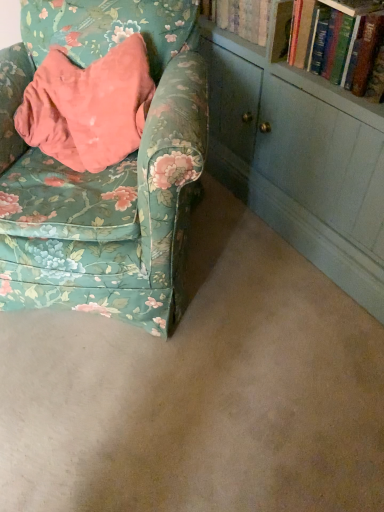
This screenshot has height=512, width=384. I want to click on free spot to the right of floral fabric chair at left, so 266,283.